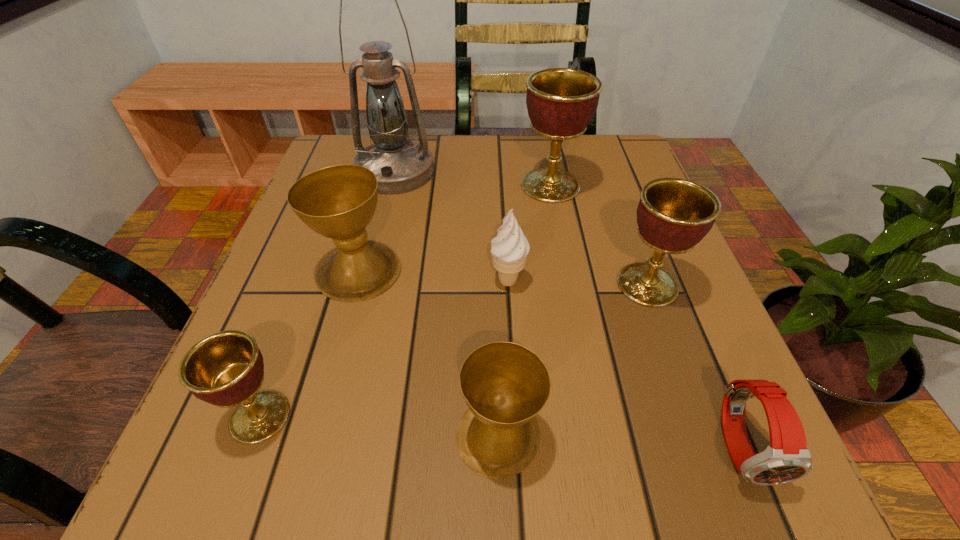
Locate an element on the screen. Image resolution: width=960 pixels, height=540 pixels. the leftmost golden chalice is located at coordinates (226, 369).

Find the location of a particular element. The width and height of the screenshot is (960, 540). the smallest golden chalice is located at coordinates (226, 369).

This screenshot has height=540, width=960. Find the location of `the shortest object`. the shortest object is located at coordinates (787, 458).

The width and height of the screenshot is (960, 540). I want to click on red watch, so click(787, 458).

Where is `vacant area situated 0.330m on the right of the oil lamp`? vacant area situated 0.330m on the right of the oil lamp is located at coordinates (581, 172).

Identify the location of free space located on the front of the second tallest object. (569, 282).

Locate an element on the screen. Image resolution: width=960 pixels, height=540 pixels. free point located 0.240m on the right of the bigger brown chalice is located at coordinates (537, 272).

Where is `free space located on the left of the rightmost golden chalice`? free space located on the left of the rightmost golden chalice is located at coordinates coord(440,285).

I want to click on vacant space located on the front-facing side of the icecream, so click(x=517, y=433).

This screenshot has height=540, width=960. Find the location of `free region located on the back of the nearer brown chalice`. free region located on the back of the nearer brown chalice is located at coordinates (493, 274).